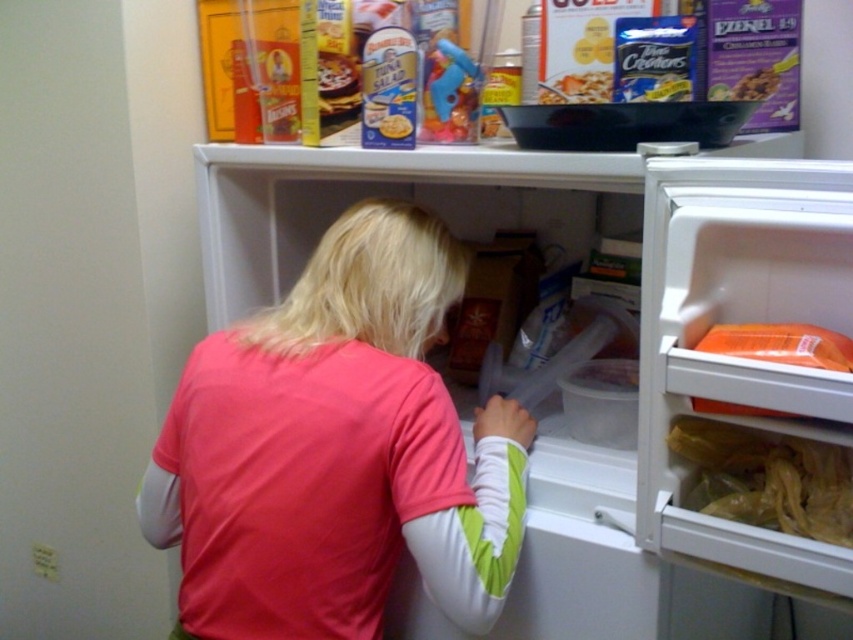
Consider the image. Which is more to the right, translucent plastic bag at lower right or matte plastic bowl at upper center?

translucent plastic bag at lower right is more to the right.

Which is more to the left, translucent plastic bag at lower right or matte plastic bowl at upper center?

matte plastic bowl at upper center is more to the left.

Is point (730, 481) behind point (572, 88)?

No.

At what (x,y) coordinates should I click in order to perform the action: click on translucent plastic bag at lower right. Please return your answer as a coordinate pair (x, y). The image size is (853, 640). Looking at the image, I should click on (769, 477).

Which of these two, pink fabric shirt at center or matte plastic bowl at upper center, stands shorter?

Standing shorter between the two is matte plastic bowl at upper center.

Is pink fabric shirt at center taller than matte plastic bowl at upper center?

Correct, pink fabric shirt at center is much taller as matte plastic bowl at upper center.

Describe the element at coordinates (335, 451) in the screenshot. I see `pink fabric shirt at center` at that location.

Where is `pink fabric shirt at center`? This screenshot has width=853, height=640. pink fabric shirt at center is located at coordinates (335, 451).

Between white plastic fridge at center and pink fabric shirt at center, which one appears on the right side from the viewer's perspective?

From the viewer's perspective, white plastic fridge at center appears more on the right side.

Consider the image. Which of these two, white plastic fridge at center or pink fabric shirt at center, stands taller?

With more height is white plastic fridge at center.

In the scene shown: Measure the distance between point (816, 588) and camera.

A distance of 26.44 inches exists between point (816, 588) and camera.

Locate an element on the screen. Image resolution: width=853 pixels, height=640 pixels. white plastic fridge at center is located at coordinates (639, 356).